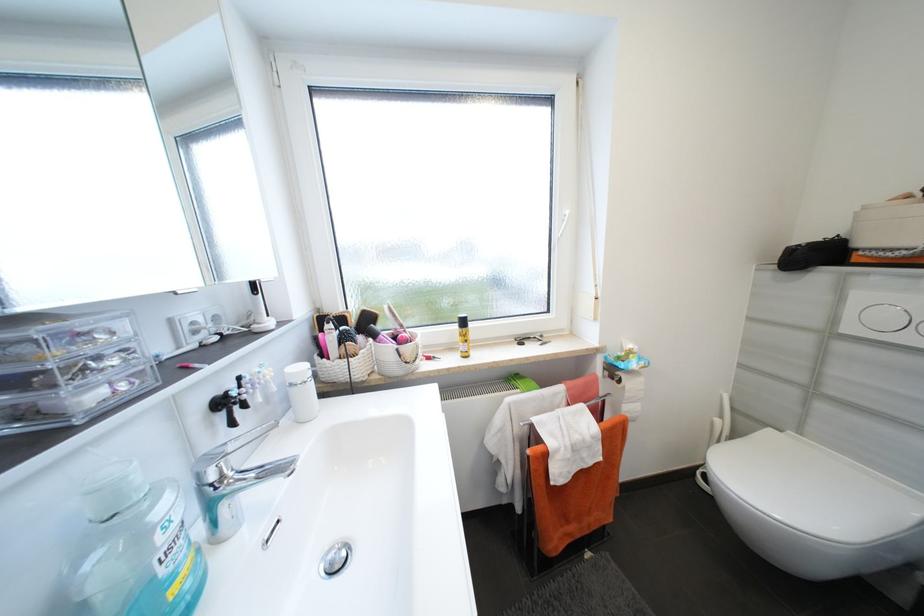
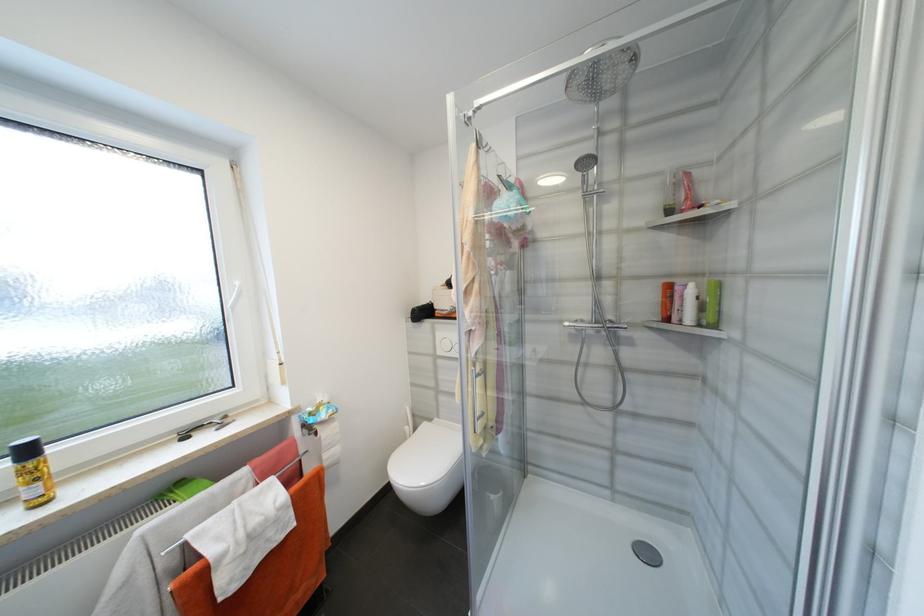
Where in the second image is the point corresponding to (x=822, y=325) from the first image?

(436, 352)